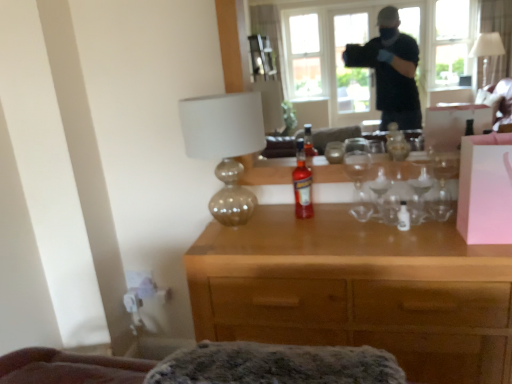
Locate an element on the screen. This screenshot has height=384, width=512. free spot below transparent glass window at upper center (from a real-world perspective) is located at coordinates (354, 205).